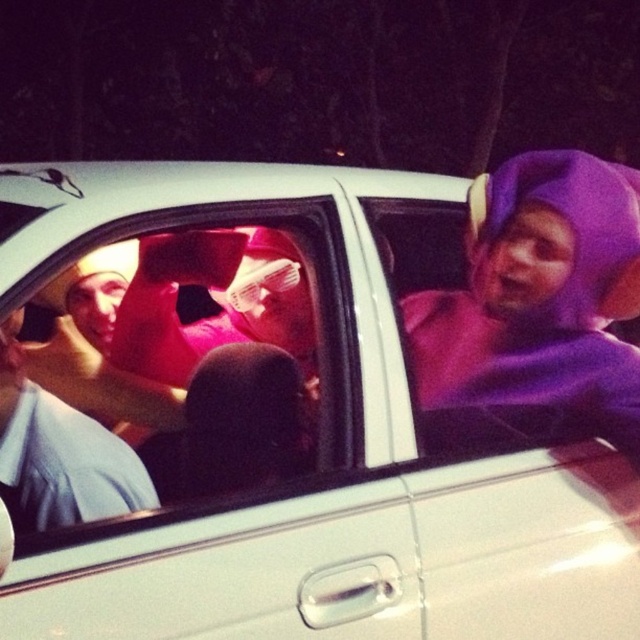
You are a pedestrian standing on the sidewalk outside the car. You see the purple fabric costume at center and the matte blue shirt at left inside the car. Which one is closer to you?

The purple fabric costume at center is positioned over matte blue shirt at left, so it is closer to you.

Consider the image. You are a passenger in the car and want to show your purple fabric costume at center to someone outside. Can you fully display the costume through the transparent plastic window at center?

The transparent plastic window at center is larger in size than purple fabric costume at center, so yes, you can fully display the purple fabric costume at center through the window.